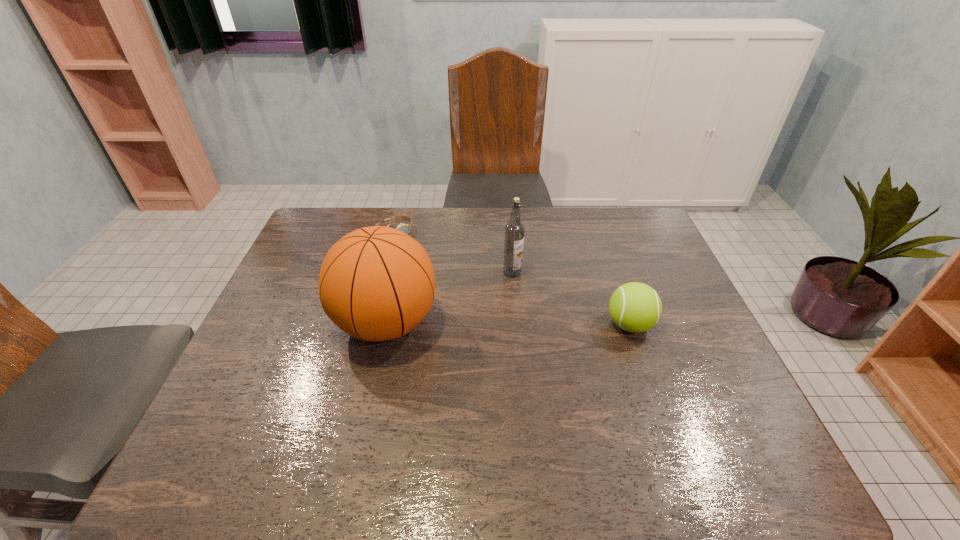
You are a GUI agent. You are given a task and a screenshot of the screen. Output one action in this format:
    pyautogui.click(x=<x>, y=<y>)
    Task: Click on the object identified as the closest to the watch
    
    Given the screenshot: What is the action you would take?
    pos(377,283)

Identify which object is the second closest to the farthest object. Please provide its 2D coordinates. Your answer should be formatted as a tuple, i.e. [(x, y)], where the tuple contains the x and y coordinates of a point satisfying the conditions above.

[(514, 230)]

You are a GUI agent. You are given a task and a screenshot of the screen. Output one action in this format:
    pyautogui.click(x=<x>, y=<y>)
    Task: Click on the vacant position in the image that satisfies the following two spatial constraints: 1. on the front side of the basketball; 2. on the right side of the farthest object
    The height and width of the screenshot is (540, 960).
    Given the screenshot: What is the action you would take?
    pyautogui.click(x=372, y=323)